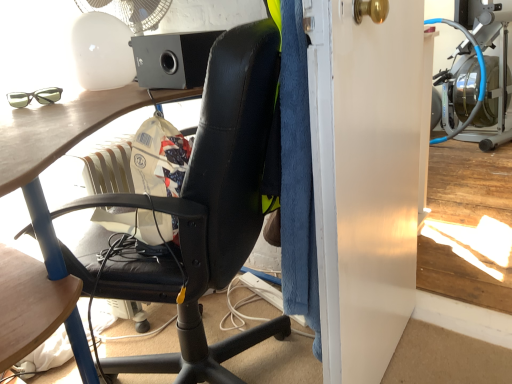
Identify the location of free space in front of matte black glasses at upper left. The image size is (512, 384). [x=36, y=111].